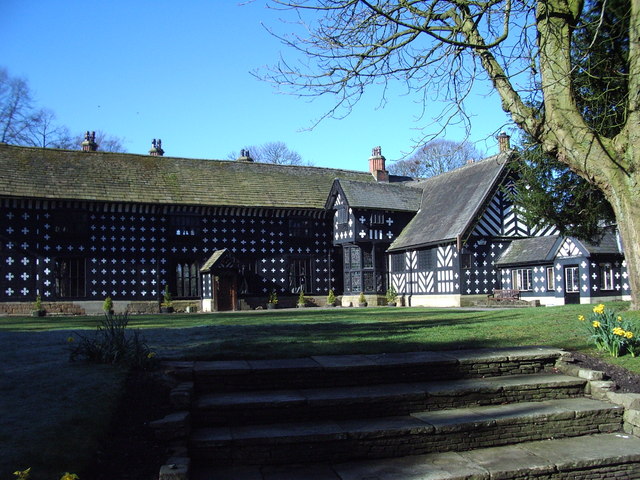
In order to click on stairs in this screenshot , I will do `click(436, 400)`.